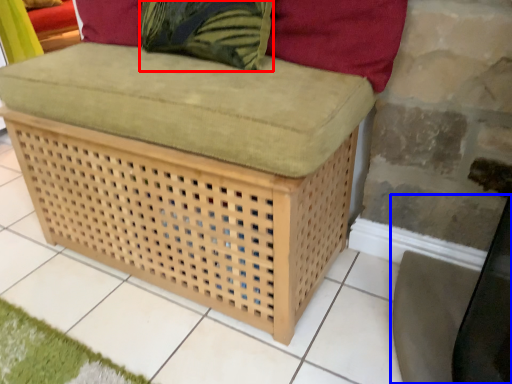
Question: Among these objects, which one is farthest to the camera, throw pillow (highlighted by a red box) or swivel chair (highlighted by a blue box)?

Choices:
 (A) throw pillow
 (B) swivel chair

Answer: (A)